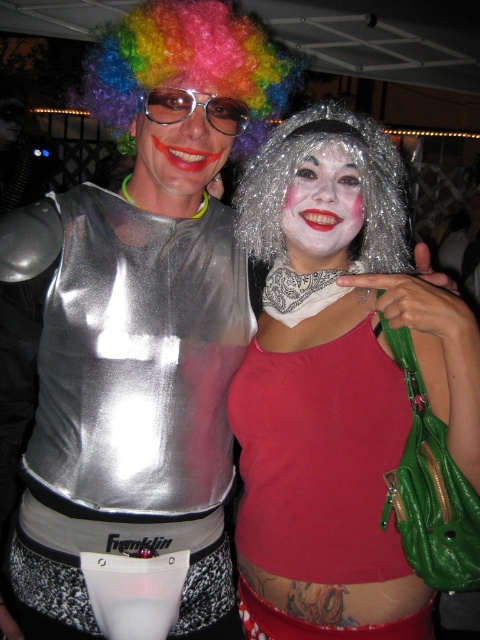
Question: Does matte red tank top at center come in front of matte plastic face at center?

Choices:
 (A) no
 (B) yes

Answer: (B)

Question: Which point is closer to the camera taking this photo?

Choices:
 (A) click(x=175, y=92)
 (B) click(x=350, y=131)
 (C) click(x=289, y=74)
 (D) click(x=276, y=125)

Answer: (A)

Question: Is rainbow curly wig at upper left bigger than shiny metallic goggles at center?

Choices:
 (A) yes
 (B) no

Answer: (A)

Question: Can you confirm if matte plastic face at center is bigger than white matte face at center?

Choices:
 (A) no
 (B) yes

Answer: (B)

Question: Which object is the closest to the matte red tank top at center?

Choices:
 (A) shiny metallic wig at center
 (B) white matte face at center
 (C) matte plastic face at center

Answer: (B)

Question: Among these points, which one is nearest to the camera?

Choices:
 (A) (383, 188)
 (B) (240, 129)

Answer: (B)